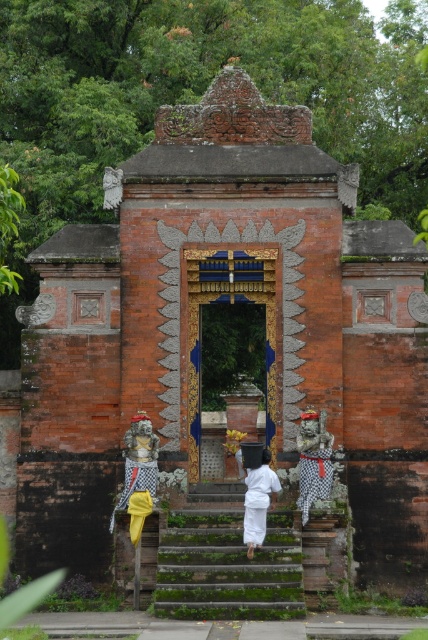
Question: Can you confirm if yellow fabric at center is positioned below checkered fabric statue at right?

Choices:
 (A) yes
 (B) no

Answer: (A)

Question: From the image, what is the correct spatial relationship of checkered fabric statue at right in relation to white cotton kimono at center?

Choices:
 (A) right
 (B) left

Answer: (A)

Question: Does green mossy stairs at center have a smaller size compared to blue painted wood door at center?

Choices:
 (A) yes
 (B) no

Answer: (B)

Question: Which object is the farthest from the white cotton kimono at center?

Choices:
 (A) checkered fabric statue at right
 (B) blue painted wood door at center

Answer: (B)

Question: Which of the following is the closest to the observer?

Choices:
 (A) green mossy stairs at center
 (B) checkered fabric statue at right
 (C) blue painted wood door at center
 (D) white cotton kimono at center

Answer: (A)

Question: Which object appears closest to the camera in this image?

Choices:
 (A) checkered fabric statue at right
 (B) green mossy stairs at center

Answer: (B)